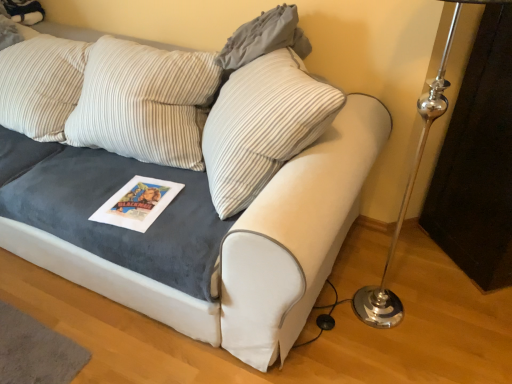
Question: Should I look upward or downward to see gray fabric pillow at upper center?

Choices:
 (A) down
 (B) up

Answer: (B)

Question: Is velvet gray couch at center behind gray fabric pillow at upper center?

Choices:
 (A) no
 (B) yes

Answer: (A)

Question: Does velvet gray couch at center have a lesser width compared to gray fabric pillow at upper center?

Choices:
 (A) no
 (B) yes

Answer: (A)

Question: Considering the relative sizes of velvet gray couch at center and gray fabric pillow at upper center in the image provided, is velvet gray couch at center bigger than gray fabric pillow at upper center?

Choices:
 (A) no
 (B) yes

Answer: (B)

Question: Could you tell me if velvet gray couch at center is turned towards gray fabric pillow at upper center?

Choices:
 (A) yes
 (B) no

Answer: (B)

Question: From the image's perspective, is velvet gray couch at center on top of gray fabric pillow at upper center?

Choices:
 (A) yes
 (B) no

Answer: (B)

Question: From a real-world perspective, is velvet gray couch at center under gray fabric pillow at upper center?

Choices:
 (A) no
 (B) yes

Answer: (B)

Question: Does gray fabric pillow at upper center have a lesser width compared to velvet gray couch at center?

Choices:
 (A) yes
 (B) no

Answer: (A)

Question: Is gray fabric pillow at upper center located outside velvet gray couch at center?

Choices:
 (A) no
 (B) yes

Answer: (B)

Question: Is velvet gray couch at center located within gray fabric pillow at upper center?

Choices:
 (A) no
 (B) yes

Answer: (A)

Question: Does gray fabric pillow at upper center touch velvet gray couch at center?

Choices:
 (A) no
 (B) yes

Answer: (A)

Question: Considering the relative sizes of gray fabric pillow at upper center and velvet gray couch at center in the image provided, is gray fabric pillow at upper center bigger than velvet gray couch at center?

Choices:
 (A) no
 (B) yes

Answer: (A)

Question: Can you confirm if gray fabric pillow at upper center is wider than velvet gray couch at center?

Choices:
 (A) no
 (B) yes

Answer: (A)

Question: In the image, is gray fabric pillow at upper center positioned in front of or behind velvet gray couch at center?

Choices:
 (A) behind
 (B) front

Answer: (A)